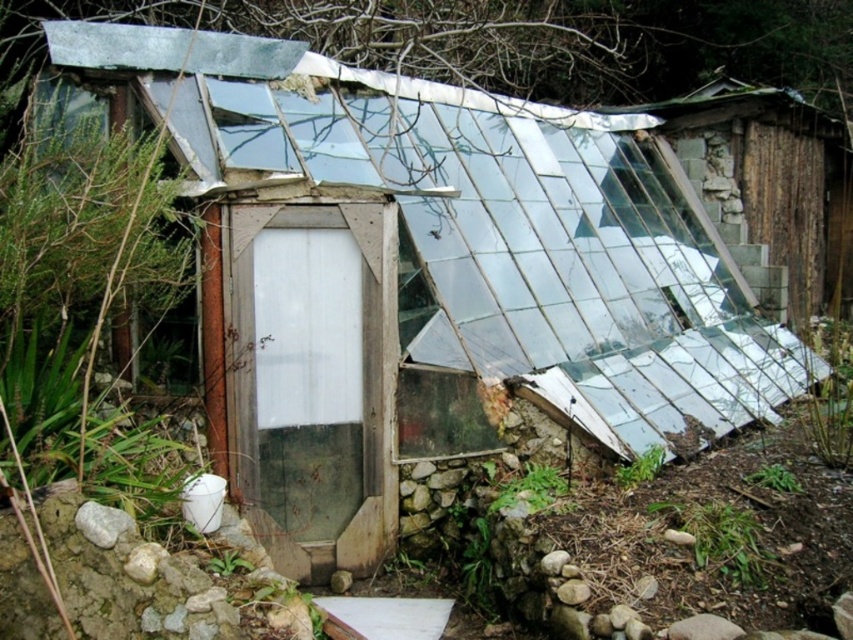
Question: Which point is closer to the camera?

Choices:
 (A) (102, 541)
 (B) (730, 104)

Answer: (A)

Question: Can you confirm if transparent glass hut at right is positioned below gray rock at lower left?

Choices:
 (A) yes
 (B) no

Answer: (B)

Question: Does transparent glass hut at right have a greater width compared to gray rock at lower left?

Choices:
 (A) yes
 (B) no

Answer: (A)

Question: Is transparent glass hut at right thinner than gray rock at lower left?

Choices:
 (A) no
 (B) yes

Answer: (A)